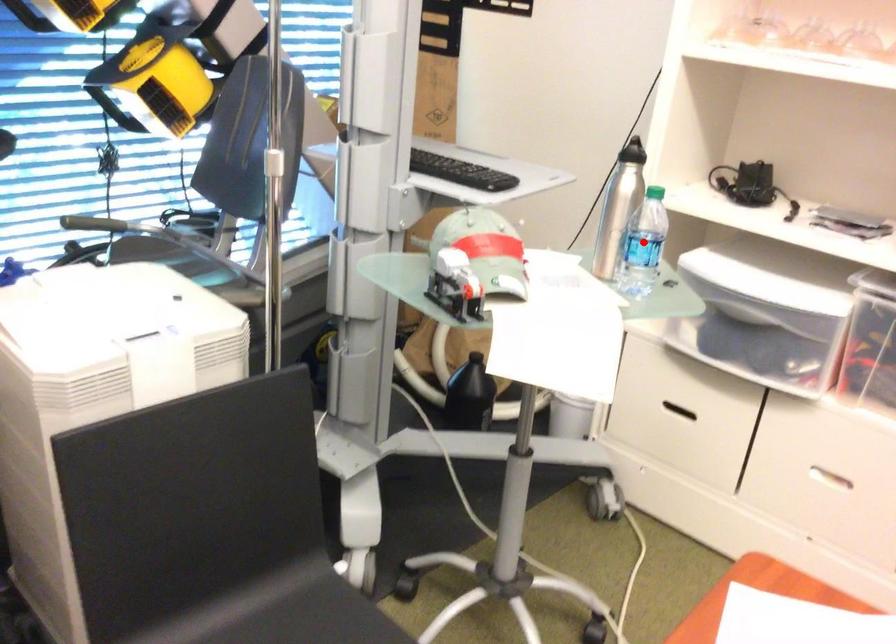
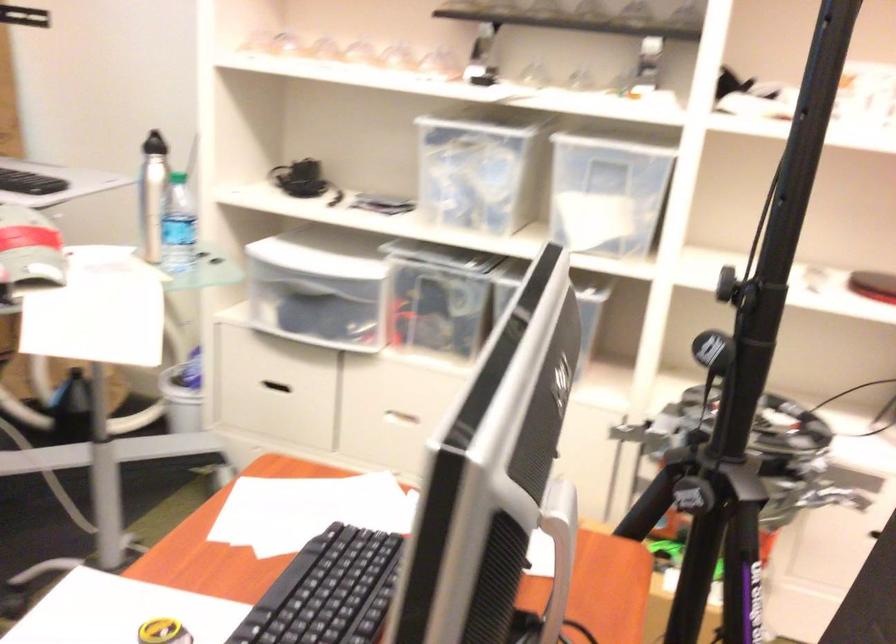
Find the pixel in the second image that matches the highlighted location in the first image.

(177, 225)